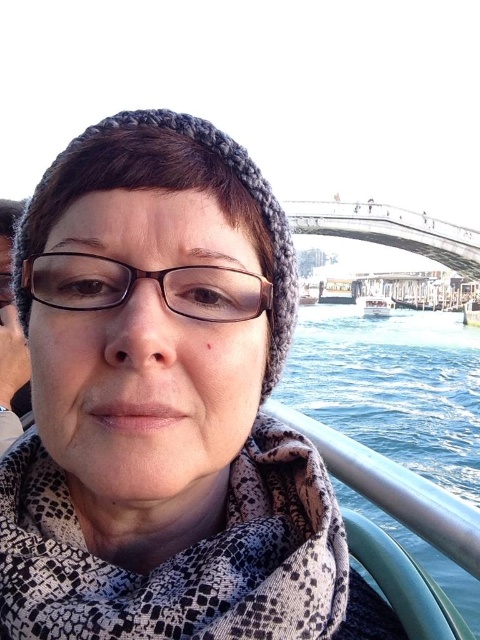
Can you confirm if concrete bridge at center is shorter than white plastic boat at center?

In fact, concrete bridge at center may be taller than white plastic boat at center.

Can you confirm if concrete bridge at center is wider than white plastic boat at center?

Correct, the width of concrete bridge at center exceeds that of white plastic boat at center.

From the picture: Who is more forward, (347, 221) or (356, 300)?

Point (347, 221) is more forward.

I want to click on concrete bridge at center, so click(x=389, y=230).

Can you confirm if black and white patterned scarf at center is positioned to the right of clear blue water at lower right?

No, black and white patterned scarf at center is not to the right of clear blue water at lower right.

Who is more distant from viewer, [276,458] or [468,605]?

Positioned behind is point [468,605].

At what (x,y) coordinates should I click in order to perform the action: click on black and white patterned scarf at center. Please return your answer as a coordinate pair (x, y). Looking at the image, I should click on (180, 556).

Who is lower down, black and white patterned scarf at center or metallic silver boat at center?

black and white patterned scarf at center is below.

At what (x,y) coordinates should I click in order to perform the action: click on black and white patterned scarf at center. Please return your answer as a coordinate pair (x, y). Looking at the image, I should click on (180, 556).